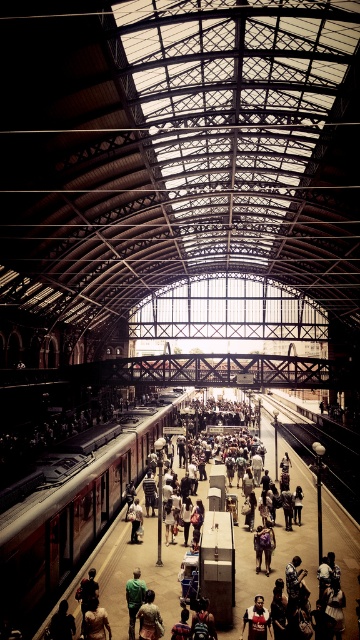
Question: Is brown leather jacket at center closer to camera compared to green fabric shirt at center?

Choices:
 (A) no
 (B) yes

Answer: (B)

Question: Can you confirm if metal train track at center is positioned above green fabric shirt at center?

Choices:
 (A) yes
 (B) no

Answer: (A)

Question: Among these objects, which one is farthest from the camera?

Choices:
 (A) reddish-brown metal train at center
 (B) green fabric shirt at center

Answer: (B)

Question: Can you confirm if leather jacket at center is positioned below green fabric shirt at center?

Choices:
 (A) yes
 (B) no

Answer: (B)

Question: Which object is the farthest from the reddish-brown metal train at center?

Choices:
 (A) leather jacket at center
 (B) green fabric shirt at center
 (C) dark brown leather jacket at center

Answer: (C)

Question: Which point is closer to the camera taking this photo?

Choices:
 (A) (141, 602)
 (B) (336, 497)

Answer: (A)